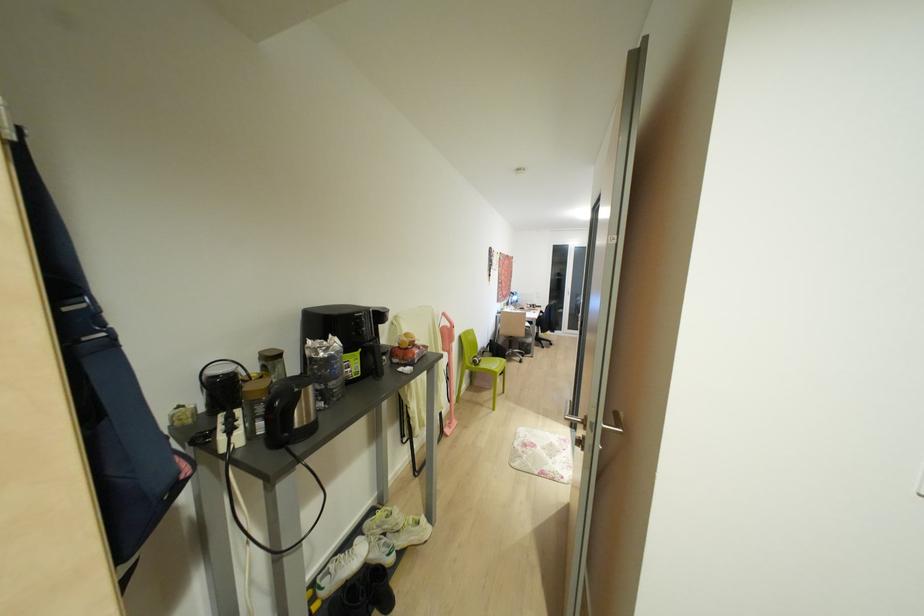
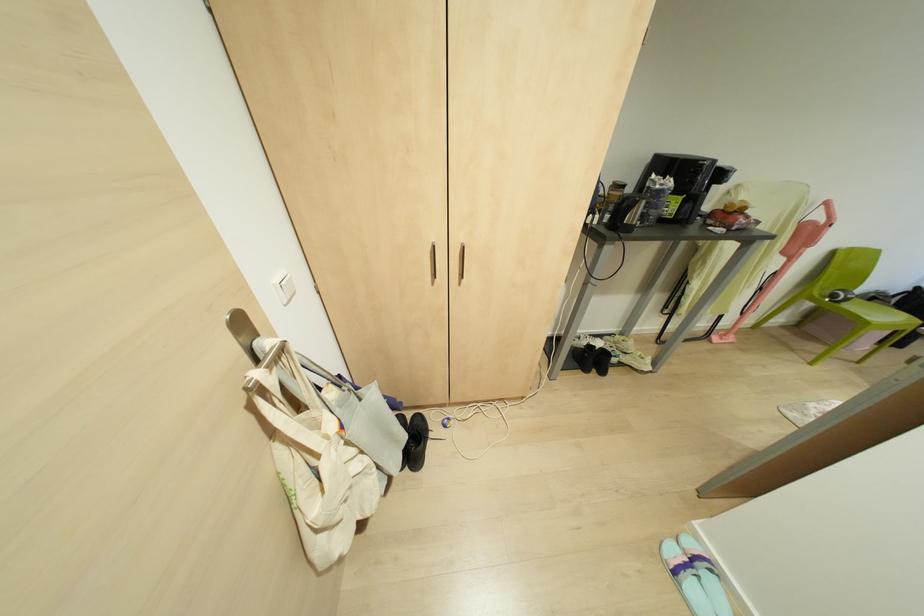
In the second image, find the point that corresponds to pixel 320 403 in the first image.

(637, 223)